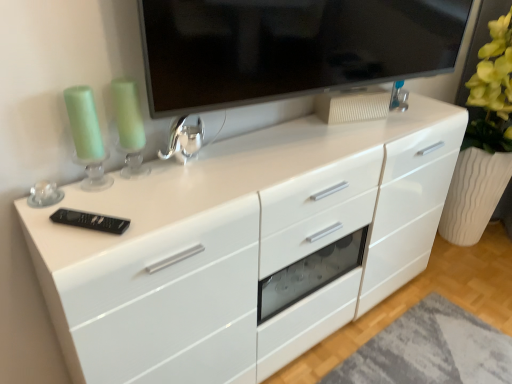
Where is `vacant point to the right of black plastic remote at lower left, which appears as the 1th appliance when viewed from the left`? The height and width of the screenshot is (384, 512). vacant point to the right of black plastic remote at lower left, which appears as the 1th appliance when viewed from the left is located at coordinates (153, 218).